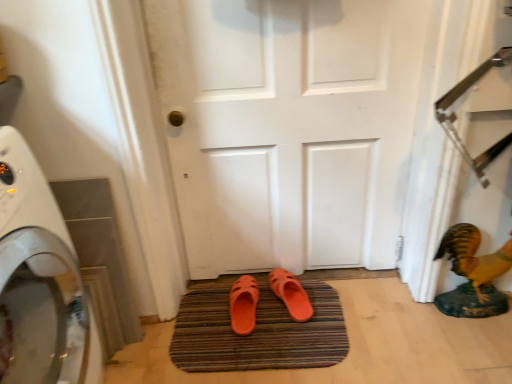
Identify the location of free space in front of orange rubber slipper at center, the 2th footwear from the right. (244, 352).